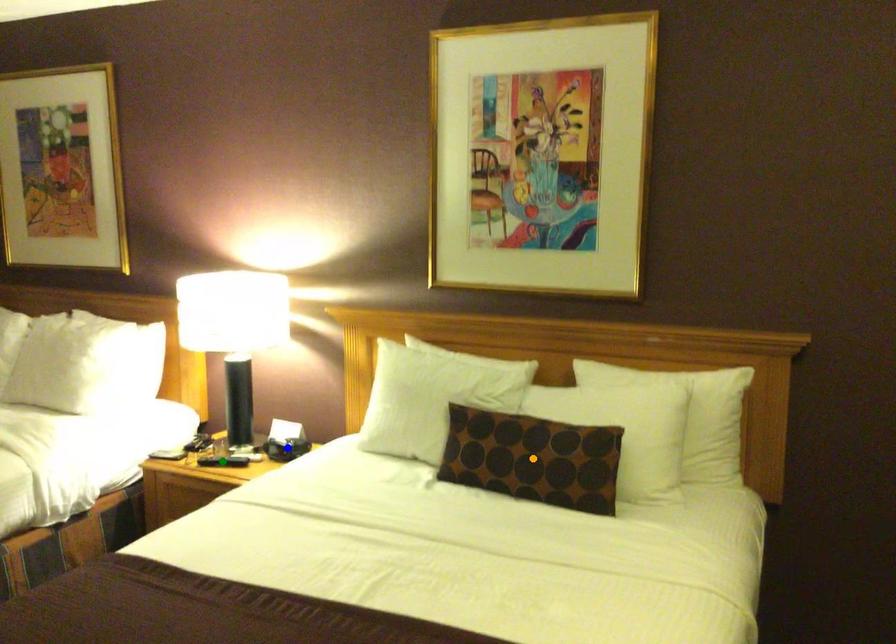
Order these from nearest to farthest:
A) green point
B) blue point
C) orange point

1. orange point
2. green point
3. blue point